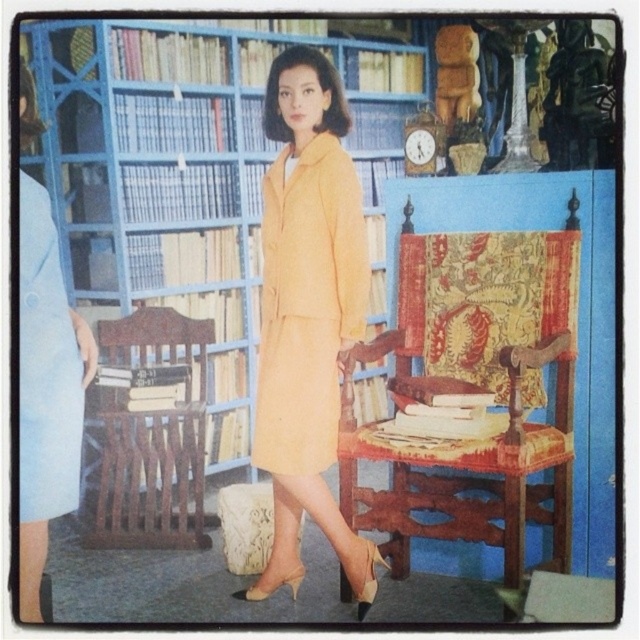
You are an interior designer assessing the room layout. You need to determine if the wooden armchair with patterned upholstery at center can fit under a standard ceiling height of 2.4 meters. The light blue fabric skirt at left is 2.3 meters tall. Can the armchair fit under the ceiling?

The wooden armchair with patterned upholstery at center has a lesser height compared to the light blue fabric skirt at left, which is 2.3 meters tall. Since the armchair is shorter than the skirt, it will definitely fit under the 2.4 meter ceiling.